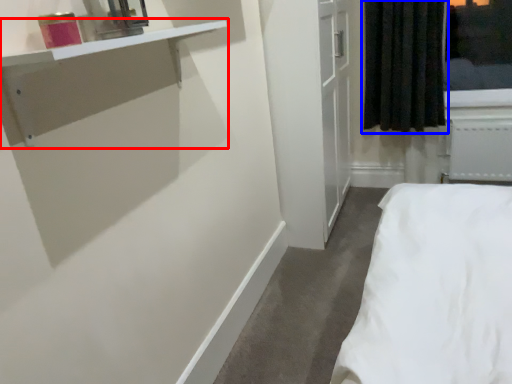
Question: Which point is further to the camera, vanity (highlighted by a red box) or curtain (highlighted by a blue box)?

Choices:
 (A) vanity
 (B) curtain

Answer: (B)